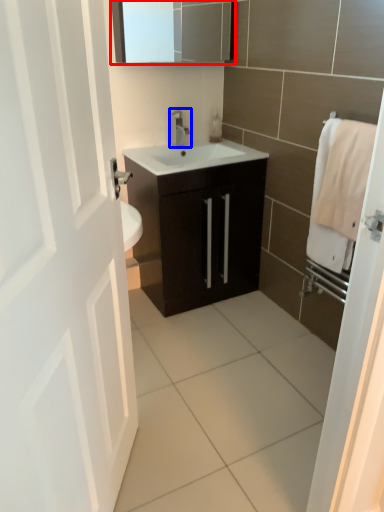
Question: Among these objects, which one is farthest to the camera, medicine cabinet (highlighted by a red box) or tap (highlighted by a blue box)?

Choices:
 (A) medicine cabinet
 (B) tap

Answer: (B)